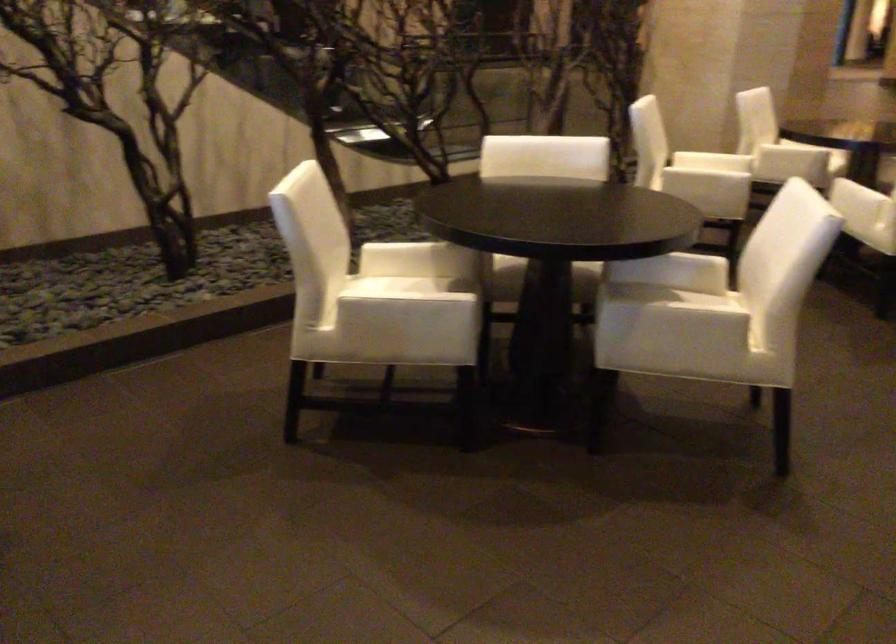
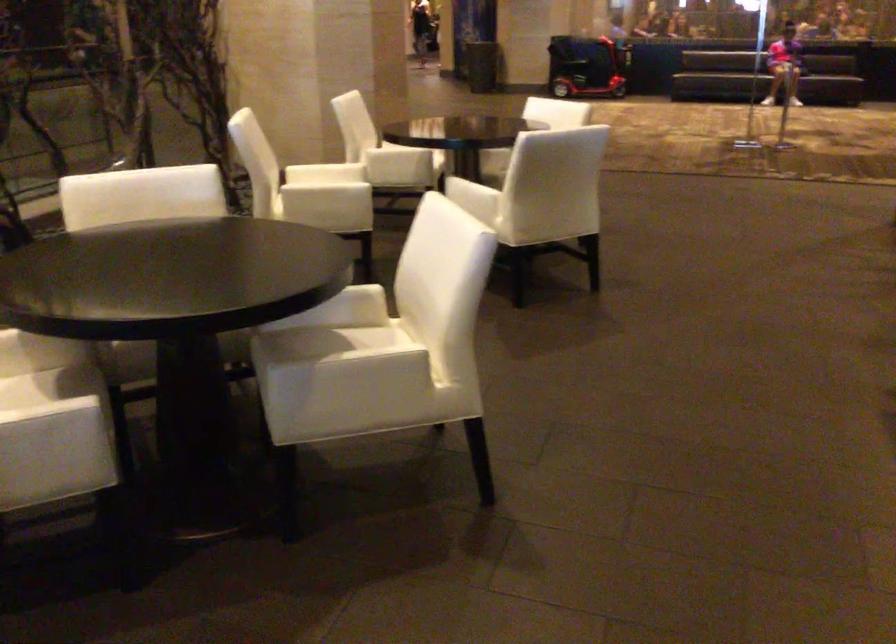
The point at (437, 308) is marked in the first image. Where is the corresponding point in the second image?

(56, 422)